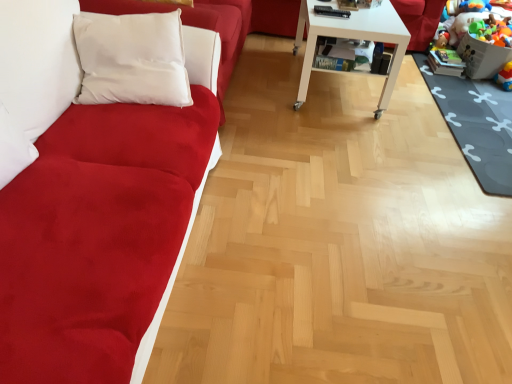
The width and height of the screenshot is (512, 384). I want to click on vacant area that lies to the right of white glossy table at center, so click(414, 94).